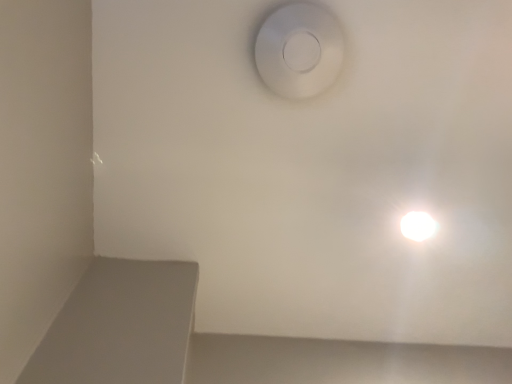
This screenshot has width=512, height=384. Describe the element at coordinates (418, 226) in the screenshot. I see `white glossy light bulb at upper right` at that location.

In order to click on white glossy light bulb at upper right in this screenshot , I will do `click(418, 226)`.

This screenshot has width=512, height=384. Identify the location of white glossy light bulb at upper right. pyautogui.click(x=418, y=226).